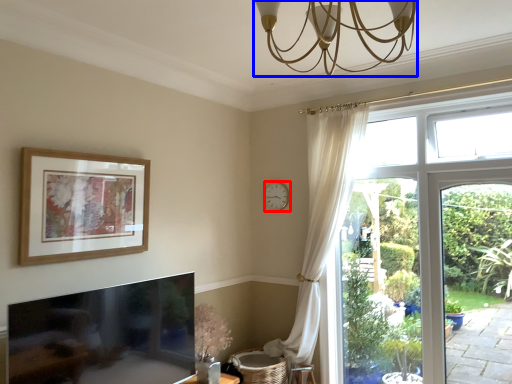
Question: Among these objects, which one is farthest to the camera, clock (highlighted by a red box) or light fixture (highlighted by a blue box)?

Choices:
 (A) clock
 (B) light fixture

Answer: (A)